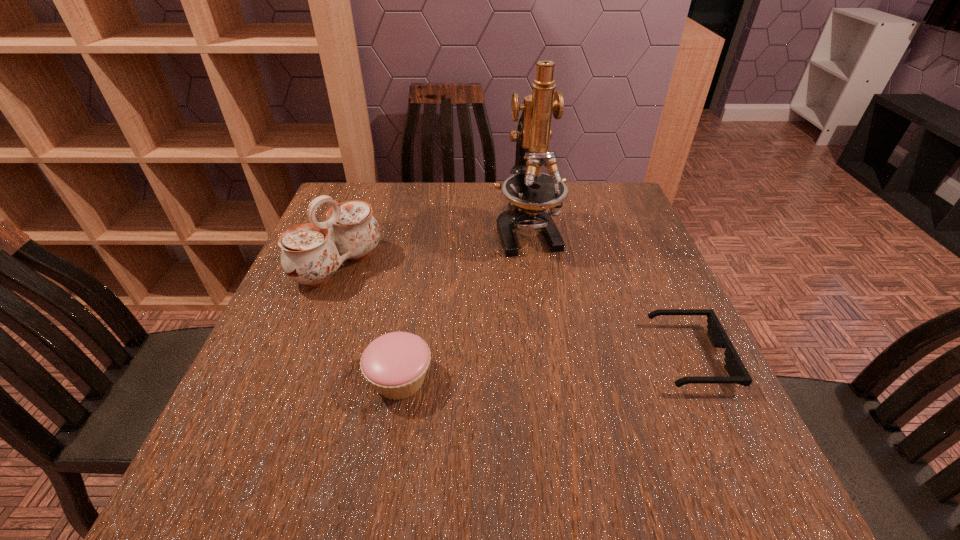
I want to click on the third object from right to left, so click(x=395, y=364).

Find the location of a particular element. This screenshot has height=540, width=960. the third tallest object is located at coordinates (395, 364).

Where is `the rightmost object`? The image size is (960, 540). the rightmost object is located at coordinates (734, 366).

Locate an element on the screen. sunglasses is located at coordinates (734, 366).

Find the location of a particular element. This screenshot has height=540, width=960. the leftmost object is located at coordinates (311, 253).

At what (x,y) coordinates should I click in order to perform the action: click on chinaware. Please return your answer as a coordinate pair (x, y). Looking at the image, I should click on (311, 253).

This screenshot has width=960, height=540. I want to click on the tallest object, so click(x=530, y=192).

Identify the location of the third object from left to right. (530, 192).

I want to click on vacant area located 0.090m on the left of the second object from left to right, so click(x=319, y=379).

Locate an element on the screen. Image resolution: width=960 pixels, height=540 pixels. free region located by the handle of the third shortest object is located at coordinates [397, 305].